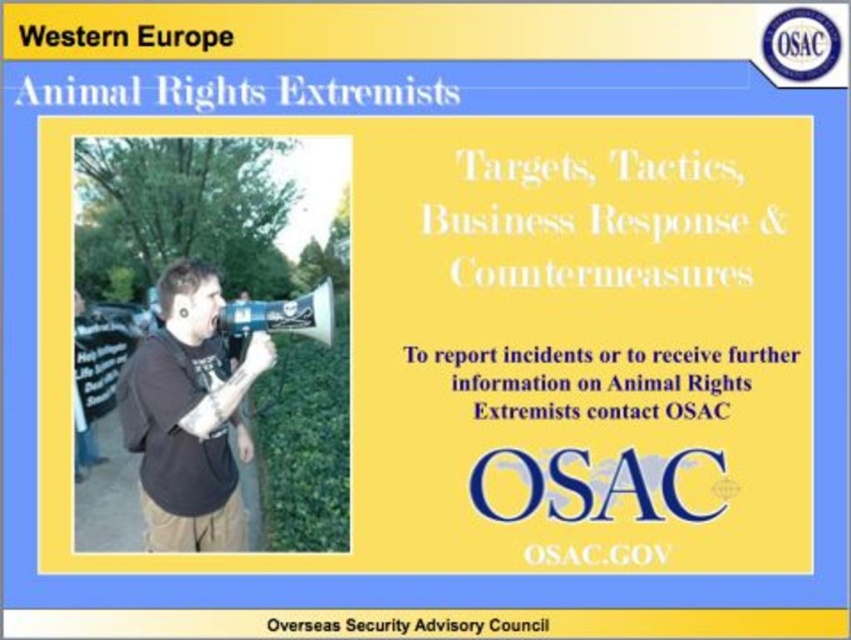
Based on the photo, is black matte megaphone at center below blue plastic megaphone at center?

Yes, black matte megaphone at center is below blue plastic megaphone at center.

Can you confirm if black matte megaphone at center is positioned to the left of blue plastic megaphone at center?

Correct, you'll find black matte megaphone at center to the left of blue plastic megaphone at center.

Does point (243, 456) come farther from viewer compared to point (326, 310)?

Yes, it is behind point (326, 310).

Locate an element on the screen. The height and width of the screenshot is (640, 851). black matte megaphone at center is located at coordinates (189, 416).